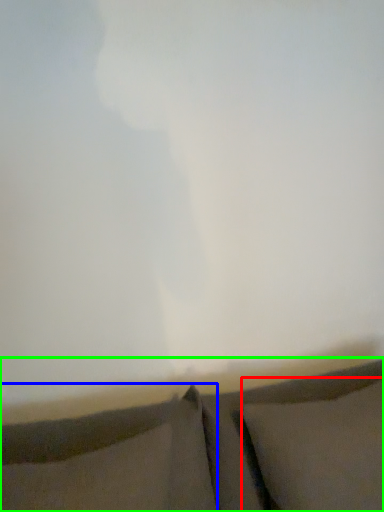
Question: Based on their relative distances, which object is nearer to pillow (highlighted by a red box)? Choose from pillow (highlighted by a blue box) and furniture (highlighted by a green box).

Choices:
 (A) pillow
 (B) furniture

Answer: (B)